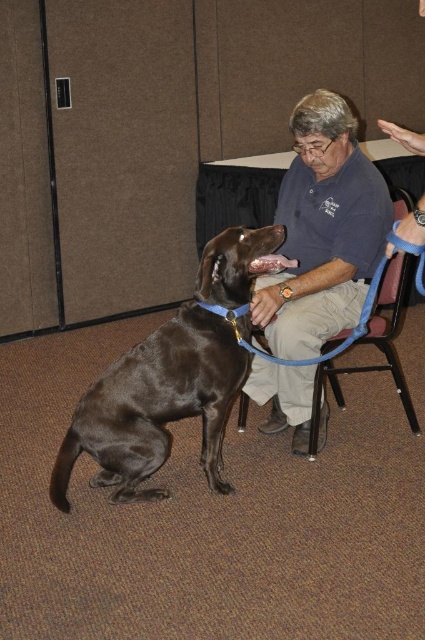
Where is `shiny brown dog at center`? The image size is (425, 640). shiny brown dog at center is located at coordinates (172, 378).

Who is positioned more to the right, shiny brown dog at center or matte blue shirt at center?

matte blue shirt at center is more to the right.

Locate an element on the screen. The image size is (425, 640). shiny brown dog at center is located at coordinates (172, 378).

Find the location of a particular element. This screenshot has height=640, width=425. shiny brown dog at center is located at coordinates (172, 378).